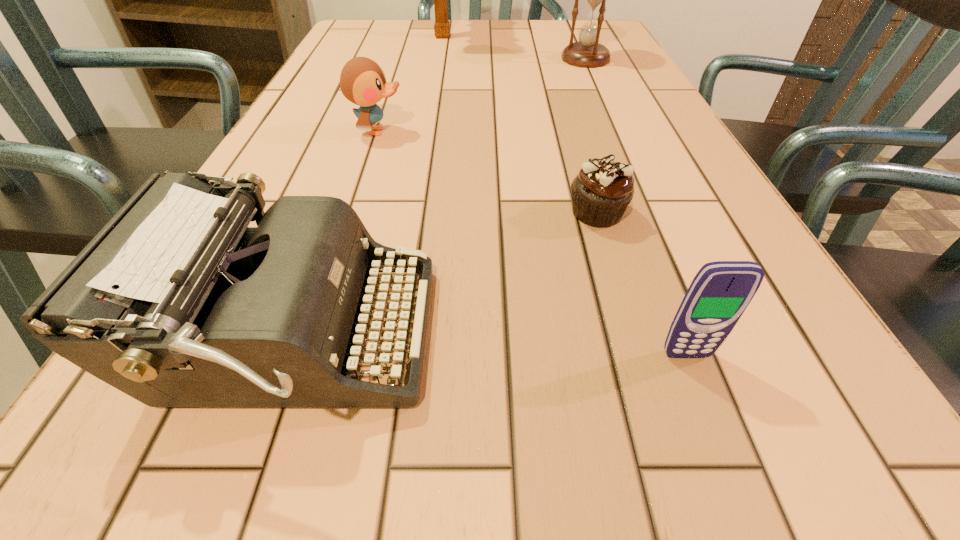
Find the location of a particular element. Image resolution: width=960 pixels, height=540 pixels. mallet is located at coordinates (441, 27).

Locate an element on the screen. The image size is (960, 540). the second tallest object is located at coordinates [x=587, y=53].

Locate an element on the screen. This screenshot has height=540, width=960. typewriter is located at coordinates (176, 302).

Where is `cellular telephone`? The width and height of the screenshot is (960, 540). cellular telephone is located at coordinates (721, 291).

Identify the location of duck. Image resolution: width=960 pixels, height=540 pixels. (362, 81).

Where is `the shortest object`? the shortest object is located at coordinates (601, 192).

Where is `the fourth farthest object`? The height and width of the screenshot is (540, 960). the fourth farthest object is located at coordinates (601, 192).

The image size is (960, 540). I want to click on free space located on the front of the tallest object, so click(x=434, y=85).

In order to click on vacant space situated 0.090m on the front of the second tallest object in this screenshot , I will do `click(597, 83)`.

Locate an element on the screen. free space located 0.240m on the front-facing side of the typewriter is located at coordinates (630, 338).